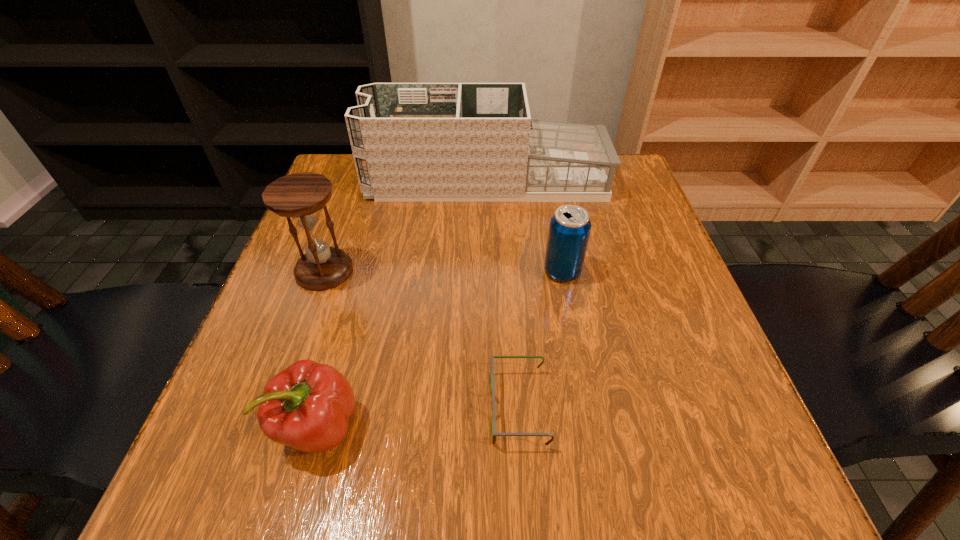
Where is `blank region between the third shortest object and the second shortest object`? This screenshot has width=960, height=540. blank region between the third shortest object and the second shortest object is located at coordinates 441,349.

Where is `unoccupied position between the third shortest object and the hourglass`? The image size is (960, 540). unoccupied position between the third shortest object and the hourglass is located at coordinates (444, 271).

The height and width of the screenshot is (540, 960). What are the coordinates of `vacant area between the shortest object and the fourth tallest object` in the screenshot? It's located at (419, 417).

Identify the location of empty space between the farthest object and the second shortest object. (402, 303).

The image size is (960, 540). In order to click on free space that is in between the hourglass and the second shortest object in this screenshot , I will do `click(322, 349)`.

The width and height of the screenshot is (960, 540). In order to click on vacant space that's between the shortest object and the farthest object in this screenshot , I will do `click(502, 294)`.

The width and height of the screenshot is (960, 540). In order to click on empty location between the third tallest object and the fourth tallest object in this screenshot , I will do `click(441, 349)`.

This screenshot has height=540, width=960. In order to click on object that stands as the closest to the third tallest object in this screenshot , I will do `click(411, 142)`.

Where is `object that is the third nearest to the shortest object`? object that is the third nearest to the shortest object is located at coordinates (299, 195).

You are a GUI agent. You are given a task and a screenshot of the screen. Output one action in this format:
    pyautogui.click(x=<x>, y=<y>)
    Task: Click on the free spot that satisfies the following two spatial constraints: 1. on the front side of the pop soda; 2. on the lens of the spectacles
    
    Given the screenshot: What is the action you would take?
    pyautogui.click(x=588, y=408)